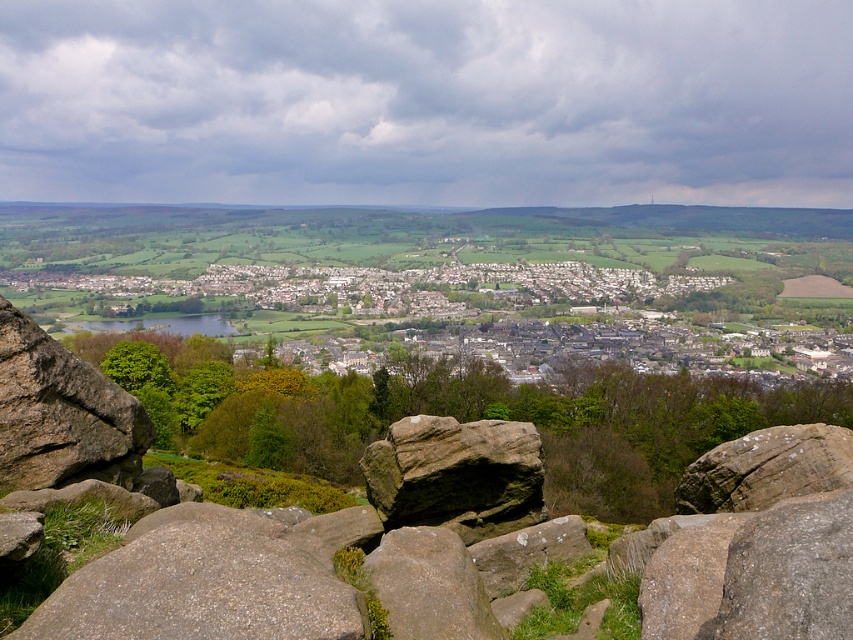
Question: Which object is closer to the camera taking this photo?

Choices:
 (A) brown rough rock at center
 (B) gray rough rock at center
 (C) gray rough rock at lower left
 (D) brown rough rock at left

Answer: (C)

Question: Which of the following is the farthest from the observer?

Choices:
 (A) (404, 451)
 (B) (96, 614)

Answer: (A)

Question: Where is white stone houses at center located in relation to brown rough rock at center in the image?

Choices:
 (A) below
 (B) above

Answer: (B)

Question: Can you confirm if white stone houses at center is wider than gray rough rock at lower left?

Choices:
 (A) no
 (B) yes

Answer: (B)

Question: Among these points, which one is farthest from the camera?

Choices:
 (A) 338,632
 (B) 421,428
 (C) 22,387

Answer: (B)

Question: Is brown rough rock at left positioned in front of gray rough rock at center?

Choices:
 (A) yes
 (B) no

Answer: (B)